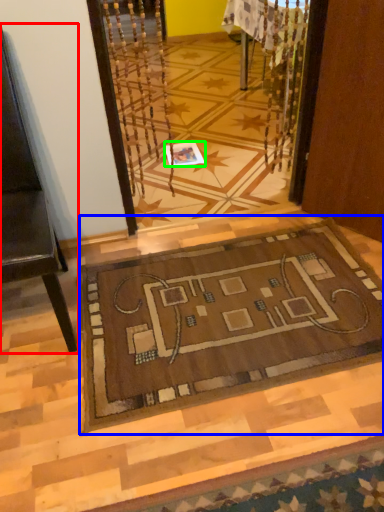
Question: Based on their relative distances, which object is farther from furniture (highlighted by a red box)? Choose from mat (highlighted by a blue box) and square (highlighted by a green box).

Choices:
 (A) mat
 (B) square

Answer: (B)